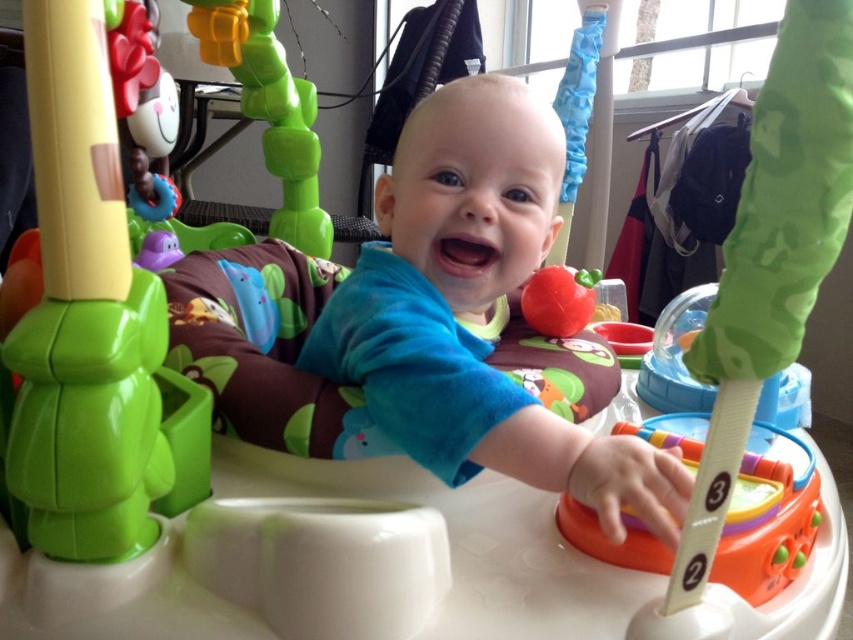
Question: Based on their relative distances, which object is farther from the green plastic toy at upper center?

Choices:
 (A) blue soft baby at center
 (B) green plastic toy at left
 (C) rubberized red apple at center
 (D) orange plastic number stick at center

Answer: (D)

Question: Does green plastic toy at left lie in front of rubberized red apple at center?

Choices:
 (A) yes
 (B) no

Answer: (A)

Question: Does blue soft baby at center appear under rubberized red apple at center?

Choices:
 (A) yes
 (B) no

Answer: (A)

Question: Is orange plastic number stick at center closer to camera compared to rubberized red apple at center?

Choices:
 (A) yes
 (B) no

Answer: (A)

Question: Which of these objects is positioned closest to the orange plastic number stick at center?

Choices:
 (A) green plastic toy at left
 (B) rubberized red apple at center
 (C) green plastic toy at upper center

Answer: (B)

Question: Which point is closer to the camera?

Choices:
 (A) green plastic toy at upper center
 (B) blue soft baby at center
 (C) rubberized red apple at center

Answer: (B)